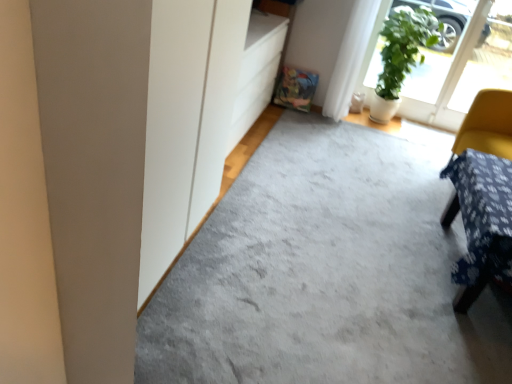
Find the location of a particular element. green matte screen door at upper right is located at coordinates [x=457, y=66].

The height and width of the screenshot is (384, 512). I want to click on green leafy plant at upper right, so click(401, 55).

Relative to blue fabric-covered table at right, is transparent glass window at upper right in front or behind?

Clearly, transparent glass window at upper right is behind blue fabric-covered table at right.

From the image's perspective, which is above, transparent glass window at upper right or blue fabric-covered table at right?

From the image's view, transparent glass window at upper right is above.

Looking at this image, is transparent glass window at upper right aimed at blue fabric-covered table at right?

Yes, transparent glass window at upper right is oriented towards blue fabric-covered table at right.

From a real-world perspective, which object stands above the other?

transparent glass window at upper right, from a real-world perspective.

In the scene shown: Is transparent glass window at upper right oriented towards yellow fabric-covered chair at right?

Yes, transparent glass window at upper right faces towards yellow fabric-covered chair at right.

In the scene shown: Can you confirm if transparent glass window at upper right is positioned to the right of yellow fabric-covered chair at right?

Yes, transparent glass window at upper right is to the right of yellow fabric-covered chair at right.

Is transparent glass window at upper right bigger or smaller than yellow fabric-covered chair at right?

transparent glass window at upper right is smaller than yellow fabric-covered chair at right.

Are yellow fabric-covered chair at right and white fabric curtain at upper right located far from each other?

yellow fabric-covered chair at right is far away from white fabric curtain at upper right.

Which is more to the left, yellow fabric-covered chair at right or white fabric curtain at upper right?

Positioned to the left is white fabric curtain at upper right.

From the image's perspective, which one is positioned higher, yellow fabric-covered chair at right or white fabric curtain at upper right?

white fabric curtain at upper right, from the image's perspective.

Considering the positions of objects yellow fabric-covered chair at right and white fabric curtain at upper right in the image provided, who is behind, yellow fabric-covered chair at right or white fabric curtain at upper right?

white fabric curtain at upper right is further away from the camera.

Does green leafy plant at upper right lie behind yellow fabric-covered chair at right?

Yes.

Does green leafy plant at upper right turn towards yellow fabric-covered chair at right?

No, green leafy plant at upper right is not turned towards yellow fabric-covered chair at right.

Is green leafy plant at upper right wider or thinner than yellow fabric-covered chair at right?

In the image, green leafy plant at upper right appears to be more narrow than yellow fabric-covered chair at right.

In the scene shown: Considering the positions of objects blue fabric-covered table at right and white fabric curtain at upper right in the image provided, who is more to the right, blue fabric-covered table at right or white fabric curtain at upper right?

From the viewer's perspective, blue fabric-covered table at right appears more on the right side.

Is blue fabric-covered table at right positioned beyond the bounds of white fabric curtain at upper right?

Yes, blue fabric-covered table at right is located beyond the bounds of white fabric curtain at upper right.

Between blue fabric-covered table at right and white fabric curtain at upper right, which one has smaller width?

Thinner between the two is white fabric curtain at upper right.

Considering the positions of objects green leafy plant at upper right and white fabric curtain at upper right in the image provided, who is more to the left, green leafy plant at upper right or white fabric curtain at upper right?

From the viewer's perspective, white fabric curtain at upper right appears more on the left side.

Between green leafy plant at upper right and white fabric curtain at upper right, which one has less height?

green leafy plant at upper right.

From the image's perspective, between green leafy plant at upper right and white fabric curtain at upper right, who is located below?

From the image's view, green leafy plant at upper right is below.

Consider the image. Is green leafy plant at upper right in contact with white fabric curtain at upper right?

No, green leafy plant at upper right is not touching white fabric curtain at upper right.

Considering their positions, is green matte screen door at upper right located in front of or behind green leafy plant at upper right?

green matte screen door at upper right is positioned farther from the viewer than green leafy plant at upper right.

Looking at this image, from a real-world perspective, between green matte screen door at upper right and green leafy plant at upper right, who is vertically higher?

green matte screen door at upper right, from a real-world perspective.

From the image's perspective, is green matte screen door at upper right beneath green leafy plant at upper right?

No, from the image's perspective, green matte screen door at upper right is not below green leafy plant at upper right.

How distant is green matte screen door at upper right from green leafy plant at upper right?

green matte screen door at upper right and green leafy plant at upper right are 35.25 centimeters apart.

Find the location of a particular element. The image size is (512, 384). furniture in front of the transparent glass window at upper right is located at coordinates click(x=480, y=222).

This screenshot has width=512, height=384. I want to click on chair below the transparent glass window at upper right (from a real-world perspective), so click(x=487, y=125).

Considering their positions, is white fabric curtain at upper right positioned closer to blue fabric-covered table at right than green leafy plant at upper right?

white fabric curtain at upper right is closer to blue fabric-covered table at right.

Which object lies nearer to the anchor point green leafy plant at upper right, blue fabric-covered table at right or yellow fabric-covered chair at right?

yellow fabric-covered chair at right.

From the image, which object appears to be nearer to transparent glass window at upper right, blue fabric-covered table at right or green leafy plant at upper right?

The object closer to transparent glass window at upper right is green leafy plant at upper right.

Looking at the image, which one is located closer to white fabric curtain at upper right, green matte screen door at upper right or yellow fabric-covered chair at right?

green matte screen door at upper right is positioned closer to the anchor white fabric curtain at upper right.

When comparing their distances from blue fabric-covered table at right, does yellow fabric-covered chair at right or green leafy plant at upper right seem further?

green leafy plant at upper right lies further to blue fabric-covered table at right than the other object.

Looking at the image, which one is located further to white fabric curtain at upper right, green leafy plant at upper right or transparent glass window at upper right?

Among the two, transparent glass window at upper right is located further to white fabric curtain at upper right.

From the image, which object appears to be farther from green leafy plant at upper right, transparent glass window at upper right or blue fabric-covered table at right?

Based on the image, blue fabric-covered table at right appears to be further to green leafy plant at upper right.

Looking at the image, which one is located closer to white fabric curtain at upper right, blue fabric-covered table at right or green matte screen door at upper right?

Based on the image, green matte screen door at upper right appears to be nearer to white fabric curtain at upper right.

The width and height of the screenshot is (512, 384). Find the location of `curtain between blue fabric-covered table at right and transparent glass window at upper right in the front-back direction`. curtain between blue fabric-covered table at right and transparent glass window at upper right in the front-back direction is located at coordinates (351, 58).

This screenshot has width=512, height=384. In order to click on houseplant positioned between blue fabric-covered table at right and transparent glass window at upper right from near to far in this screenshot , I will do `click(401, 55)`.

Locate an element on the screen. The width and height of the screenshot is (512, 384). chair between blue fabric-covered table at right and green leafy plant at upper right from front to back is located at coordinates (487, 125).

Where is `screen door located between yellow fabric-covered chair at right and transparent glass window at upper right in the depth direction`? The image size is (512, 384). screen door located between yellow fabric-covered chair at right and transparent glass window at upper right in the depth direction is located at coordinates (457, 66).